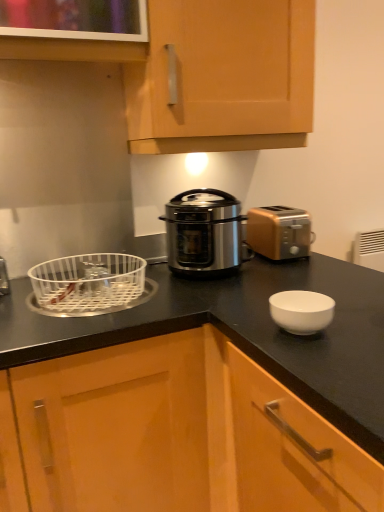
Question: Does white plastic basket at left come behind light wood cabinet at upper center, which is the 1th cabinetry from top to bottom?

Choices:
 (A) no
 (B) yes

Answer: (A)

Question: Considering the relative positions of white plastic basket at left and light wood cabinet at upper center, which is the 1th cabinetry from top to bottom, in the image provided, is white plastic basket at left in front of light wood cabinet at upper center, which is the 1th cabinetry from top to bottom,?

Choices:
 (A) no
 (B) yes

Answer: (B)

Question: Is white plastic basket at left with light wood cabinet at upper center, positioned as the second cabinetry in bottom-to-top order?

Choices:
 (A) yes
 (B) no

Answer: (B)

Question: Considering the relative positions of white plastic basket at left and light wood cabinet at upper center, which is the 1th cabinetry from top to bottom, in the image provided, is white plastic basket at left to the right of light wood cabinet at upper center, which is the 1th cabinetry from top to bottom, from the viewer's perspective?

Choices:
 (A) no
 (B) yes

Answer: (A)

Question: From the image's perspective, is white plastic basket at left on top of light wood cabinet at upper center, positioned as the second cabinetry in bottom-to-top order?

Choices:
 (A) no
 (B) yes

Answer: (A)

Question: Is white plastic basket at left thinner than light wood cabinet at upper center, positioned as the second cabinetry in bottom-to-top order?

Choices:
 (A) no
 (B) yes

Answer: (A)

Question: Considering the relative sizes of gold metallic toaster at right and white plastic basket at left in the image provided, is gold metallic toaster at right shorter than white plastic basket at left?

Choices:
 (A) no
 (B) yes

Answer: (A)

Question: Considering the relative sizes of gold metallic toaster at right and white plastic basket at left in the image provided, is gold metallic toaster at right wider than white plastic basket at left?

Choices:
 (A) yes
 (B) no

Answer: (B)

Question: Considering the relative positions of gold metallic toaster at right and white plastic basket at left in the image provided, is gold metallic toaster at right behind white plastic basket at left?

Choices:
 (A) no
 (B) yes

Answer: (B)

Question: Is gold metallic toaster at right positioned with its back to white plastic basket at left?

Choices:
 (A) yes
 (B) no

Answer: (B)

Question: Can white plastic basket at left be found inside gold metallic toaster at right?

Choices:
 (A) no
 (B) yes

Answer: (A)

Question: Does gold metallic toaster at right have a lesser width compared to white plastic basket at left?

Choices:
 (A) no
 (B) yes

Answer: (B)

Question: From the image's perspective, is gold metallic toaster at right below wooden cabinet at center, which ranks as the 2th cabinetry in top-to-bottom order?

Choices:
 (A) yes
 (B) no

Answer: (B)